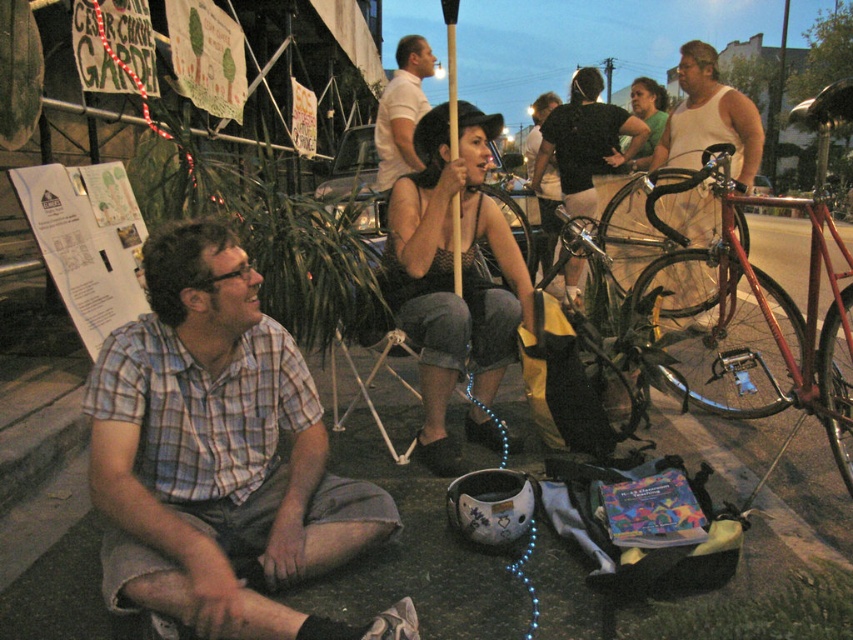
Question: Is white paper at left to the right of matte green tank top at center from the viewer's perspective?

Choices:
 (A) yes
 (B) no

Answer: (B)

Question: Where is matte black tank top at center located in relation to black tank top at center in the image?

Choices:
 (A) above
 (B) below

Answer: (B)

Question: Which object appears farthest from the camera in this image?

Choices:
 (A) matte green tank top at center
 (B) smooth white tank top at center

Answer: (B)

Question: Does white paper at left have a larger size compared to matte green tank top at center?

Choices:
 (A) yes
 (B) no

Answer: (B)

Question: Which point is closer to the camera?

Choices:
 (A) plaid cotton shirt at lower left
 (B) matte black tank top at center

Answer: (A)

Question: Which of these objects is positioned farthest from the shiny red bicycle at right?

Choices:
 (A) matte green tank top at center
 (B) smooth white tank top at center
 (C) white tank top at right

Answer: (B)